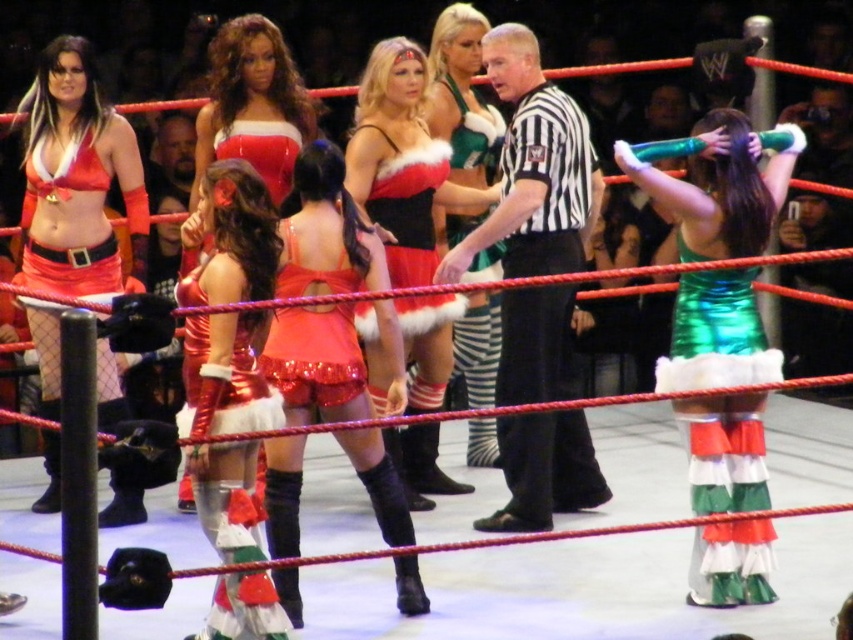
Question: Among these points, which one is nearest to the camera?

Choices:
 (A) (111, 372)
 (B) (283, 625)

Answer: (B)

Question: Is shiny metallic skirt at center to the left of matte red dress at left from the viewer's perspective?

Choices:
 (A) no
 (B) yes

Answer: (A)

Question: Which point is farther to the camera?

Choices:
 (A) (247, 365)
 (B) (500, 426)
 (C) (450, 368)

Answer: (C)

Question: Does black striped shirt at center have a lesser width compared to shiny sequined dress at center?

Choices:
 (A) yes
 (B) no

Answer: (B)

Question: Which object appears farthest from the camera in this image?

Choices:
 (A) green shiny dress at center
 (B) shiny sequined dress at center
 (C) black striped shirt at center
 (D) green shiny dress at right

Answer: (A)

Question: Considering the relative positions of green shiny dress at right and shiny metallic skirt at center in the image provided, where is green shiny dress at right located with respect to shiny metallic skirt at center?

Choices:
 (A) below
 (B) above

Answer: (B)